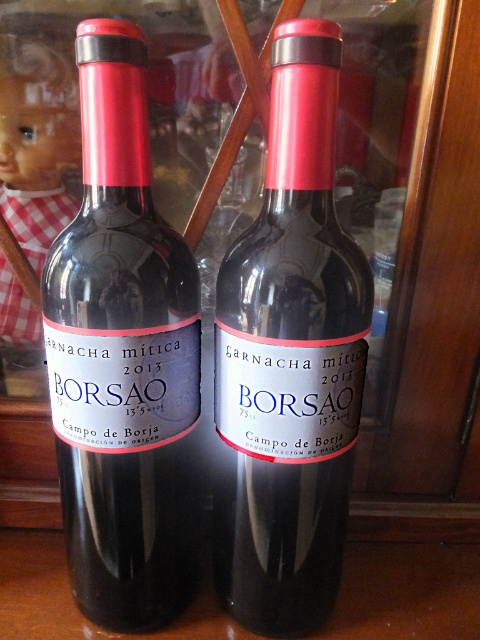
Who is positioned more to the left, matte glass wine bottle at center or matte plastic doll at left?

matte plastic doll at left

What do you see at coordinates (289, 360) in the screenshot?
I see `matte glass wine bottle at center` at bounding box center [289, 360].

The height and width of the screenshot is (640, 480). Find the location of `matte glass wine bottle at center`. matte glass wine bottle at center is located at coordinates (289, 360).

Does point (137, 237) come closer to viewer compared to point (324, 460)?

Yes.

The height and width of the screenshot is (640, 480). What are the coordinates of `matte black bottle at left` in the screenshot? It's located at (122, 356).

Does point (164, 548) come farther from viewer compared to point (324, 131)?

That is True.

In order to click on matte black bottle at left in this screenshot , I will do `click(122, 356)`.

Does point (149, 259) come behind point (51, 236)?

No, it is not.

Can you confirm if matte black bottle at left is wider than matte plastic doll at left?

Yes.

This screenshot has width=480, height=640. Describe the element at coordinates (122, 356) in the screenshot. I see `matte black bottle at left` at that location.

You are a GUI agent. You are given a task and a screenshot of the screen. Output one action in this format:
    pyautogui.click(x=<x>, y=<y>)
    Task: Click on the matte black bottle at left
    
    Given the screenshot: What is the action you would take?
    pyautogui.click(x=122, y=356)